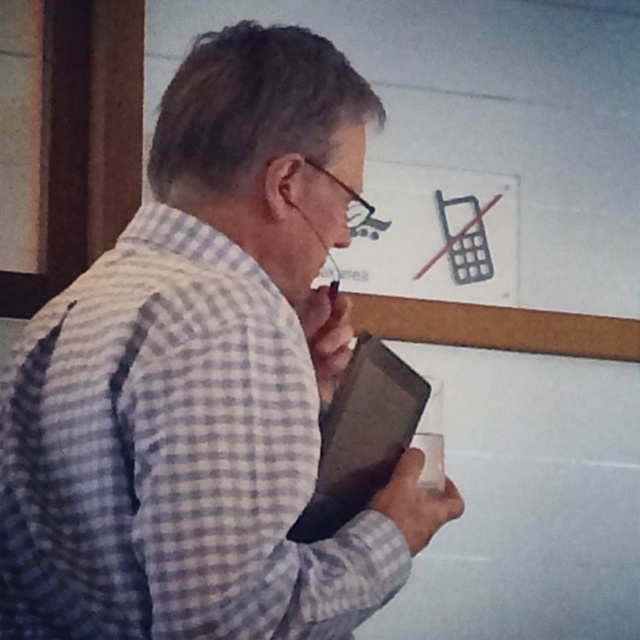
Who is positioned more to the right, checkered fabric shirt at center or white matte bulletin board at upper center?

white matte bulletin board at upper center

Is point (291, 516) positioned before point (356, 24)?

Yes, it is in front of point (356, 24).

Is point (154, 198) farther from viewer compared to point (600, 35)?

No.

I want to click on checkered fabric shirt at center, so click(205, 380).